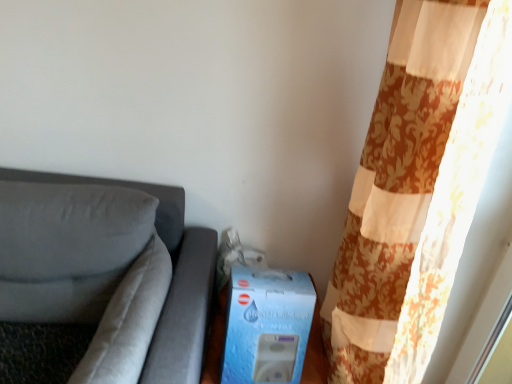
This screenshot has width=512, height=384. What are the coordinates of `blue cardboard box at lower center` in the screenshot? It's located at (267, 328).

This screenshot has width=512, height=384. What do you see at coordinates (71, 229) in the screenshot?
I see `suede-like gray pillow at left` at bounding box center [71, 229].

Locate an element on the screen. The image size is (512, 384). suede gray couch at left is located at coordinates (109, 275).

Which is less distant, (507, 49) or (34, 298)?

Point (507, 49) is positioned closer to the camera compared to point (34, 298).

Is floral fabric curtain at right far from suede gray couch at left?

floral fabric curtain at right is near suede gray couch at left, not far away.

Can you confirm if floral fabric curtain at right is shorter than suede gray couch at left?

No.

Is floral fabric curtain at right thinner than suede gray couch at left?

Yes.

From a real-world perspective, is suede-like gray pillow at left above or below suede gray couch at left?

Clearly, from a real-world perspective, suede-like gray pillow at left is above suede gray couch at left.

How distant is suede-like gray pillow at left from suede gray couch at left?

The distance of suede-like gray pillow at left from suede gray couch at left is 3.05 inches.

Based on the photo, is suede-like gray pillow at left looking in the opposite direction of suede gray couch at left?

Absolutely, suede-like gray pillow at left is directed away from suede gray couch at left.

From the image's perspective, is suede-like gray pillow at left located above or below suede gray couch at left?

Clearly, from the image's perspective, suede-like gray pillow at left is above suede gray couch at left.

What's the angular difference between blue cardboard box at lower center and suede gray couch at left's facing directions?

They differ by 0.346 degrees in their facing directions.

Considering the positions of point (277, 314) and point (5, 202), is point (277, 314) closer or farther from the camera than point (5, 202)?

Point (277, 314) is positioned closer to the camera compared to point (5, 202).

Is blue cardboard box at lower center spatially inside suede gray couch at left, or outside of it?

blue cardboard box at lower center cannot be found inside suede gray couch at left.

Considering the relative sizes of blue cardboard box at lower center and suede gray couch at left in the image provided, is blue cardboard box at lower center bigger than suede gray couch at left?

Actually, blue cardboard box at lower center might be smaller than suede gray couch at left.

Is the depth of suede gray couch at left less than that of blue cardboard box at lower center?

Yes, suede gray couch at left is in front of blue cardboard box at lower center.

Considering the relative sizes of suede gray couch at left and blue cardboard box at lower center in the image provided, is suede gray couch at left smaller than blue cardboard box at lower center?

Incorrect, suede gray couch at left is not smaller in size than blue cardboard box at lower center.

Considering the sizes of objects suede gray couch at left and blue cardboard box at lower center in the image provided, who is wider, suede gray couch at left or blue cardboard box at lower center?

Wider between the two is suede gray couch at left.

Considering the sizes of objects suede gray couch at left and blue cardboard box at lower center in the image provided, who is shorter, suede gray couch at left or blue cardboard box at lower center?

blue cardboard box at lower center is shorter.

How much distance is there between floral fabric curtain at right and blue cardboard box at lower center?

floral fabric curtain at right is 31.69 centimeters from blue cardboard box at lower center.

Is floral fabric curtain at right not near blue cardboard box at lower center?

No, floral fabric curtain at right is in close proximity to blue cardboard box at lower center.

Find the location of a particular element. The height and width of the screenshot is (384, 512). curtain above the blue cardboard box at lower center (from a real-world perspective) is located at coordinates (417, 187).

How many degrees apart are the facing directions of floral fabric curtain at right and suede-like gray pillow at left?

They differ by 89.1 degrees in their facing directions.

Is floral fabric curtain at right wider than suede-like gray pillow at left?

Yes.

Could you tell me if floral fabric curtain at right is facing suede-like gray pillow at left?

Yes, floral fabric curtain at right faces towards suede-like gray pillow at left.

Who is more distant, floral fabric curtain at right or suede-like gray pillow at left?

suede-like gray pillow at left is further from the camera.

Which object is thinner, blue cardboard box at lower center or floral fabric curtain at right?

Thinner between the two is blue cardboard box at lower center.

How many degrees apart are the facing directions of blue cardboard box at lower center and floral fabric curtain at right?

89.1 degrees.

Is blue cardboard box at lower center positioned with its back to floral fabric curtain at right?

No, floral fabric curtain at right is not at the back of blue cardboard box at lower center.

Consider the image. Which object is more forward, blue cardboard box at lower center or floral fabric curtain at right?

floral fabric curtain at right is in front.

You are a GUI agent. You are given a task and a screenshot of the screen. Output one action in this format:
    pyautogui.click(x=<x>, y=<y>)
    Task: Click on the curtain located above the suede gray couch at left (from a real-world perspective)
    Image resolution: width=512 pixels, height=384 pixels.
    Given the screenshot: What is the action you would take?
    pyautogui.click(x=417, y=187)

The image size is (512, 384). In order to click on pillow on the right of suede gray couch at left in this screenshot , I will do `click(71, 229)`.

Based on their spatial positions, is suede-like gray pillow at left or floral fabric curtain at right closer to suede gray couch at left?

Among the two, suede-like gray pillow at left is located nearer to suede gray couch at left.

From the image, which object appears to be nearer to blue cardboard box at lower center, suede-like gray pillow at left or floral fabric curtain at right?

Based on the image, floral fabric curtain at right appears to be nearer to blue cardboard box at lower center.

Which object lies further to the anchor point suede-like gray pillow at left, suede gray couch at left or blue cardboard box at lower center?

blue cardboard box at lower center lies further to suede-like gray pillow at left than the other object.

Estimate the real-world distances between objects in this image. Which object is further from suede gray couch at left, floral fabric curtain at right or blue cardboard box at lower center?

The object further to suede gray couch at left is floral fabric curtain at right.

When comparing their distances from floral fabric curtain at right, does suede gray couch at left or blue cardboard box at lower center seem closer?

Among the two, blue cardboard box at lower center is located nearer to floral fabric curtain at right.

From the image, which object appears to be farther from blue cardboard box at lower center, floral fabric curtain at right or suede gray couch at left?

floral fabric curtain at right.

Looking at this image, when comparing their distances from blue cardboard box at lower center, does floral fabric curtain at right or suede-like gray pillow at left seem further?

Based on the image, suede-like gray pillow at left appears to be further to blue cardboard box at lower center.

From the image, which object appears to be farther from floral fabric curtain at right, suede gray couch at left or suede-like gray pillow at left?

suede-like gray pillow at left is further to floral fabric curtain at right.

Locate an element on the screen. pillow between suede gray couch at left and blue cardboard box at lower center is located at coordinates (71, 229).

At what (x,y) coordinates should I click in order to perform the action: click on box between suede gray couch at left and floral fabric curtain at right in the horizontal direction. Please return your answer as a coordinate pair (x, y). Looking at the image, I should click on (267, 328).

Where is `pillow situated between suede gray couch at left and floral fabric curtain at right from left to right`? The image size is (512, 384). pillow situated between suede gray couch at left and floral fabric curtain at right from left to right is located at coordinates (71, 229).

The width and height of the screenshot is (512, 384). I want to click on box situated between suede-like gray pillow at left and floral fabric curtain at right from left to right, so [267, 328].